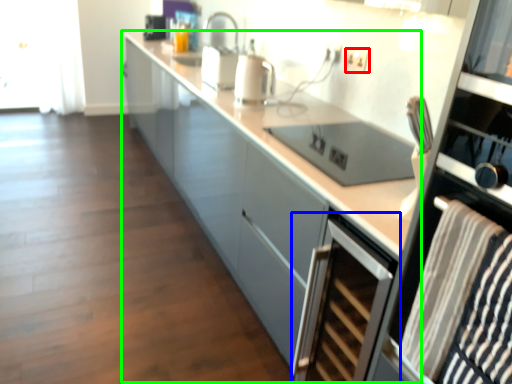
Question: Estimate the real-world distances between objects in this image. Which object is farther from electric outlet (highlighted by a red box), home appliance (highlighted by a blue box) or cabinetry (highlighted by a green box)?

Choices:
 (A) home appliance
 (B) cabinetry

Answer: (A)